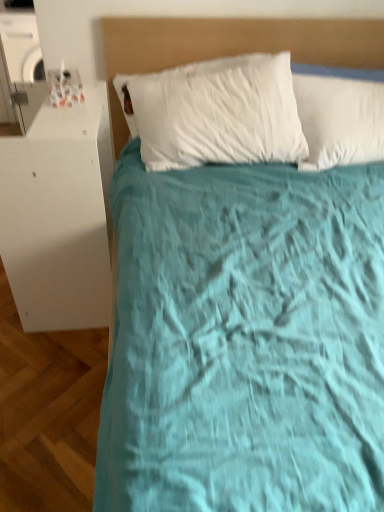
Question: Which is correct: white glossy cabinet at left is inside matte beige headboard at upper center, or outside of it?

Choices:
 (A) inside
 (B) outside

Answer: (B)

Question: Relative to matte beige headboard at upper center, is white glossy cabinet at left in front or behind?

Choices:
 (A) front
 (B) behind

Answer: (A)

Question: Is white glossy cabinet at left taller or shorter than matte beige headboard at upper center?

Choices:
 (A) short
 (B) tall

Answer: (B)

Question: Is matte beige headboard at upper center situated inside white glossy cabinet at left or outside?

Choices:
 (A) outside
 (B) inside

Answer: (A)

Question: Does point (170, 31) appear closer or farther from the camera than point (23, 291)?

Choices:
 (A) farther
 (B) closer

Answer: (A)

Question: Is matte beige headboard at upper center to the left or to the right of white glossy cabinet at left in the image?

Choices:
 (A) left
 (B) right

Answer: (B)

Question: Considering the positions of matte beige headboard at upper center and white glossy cabinet at left in the image, is matte beige headboard at upper center taller or shorter than white glossy cabinet at left?

Choices:
 (A) short
 (B) tall

Answer: (A)